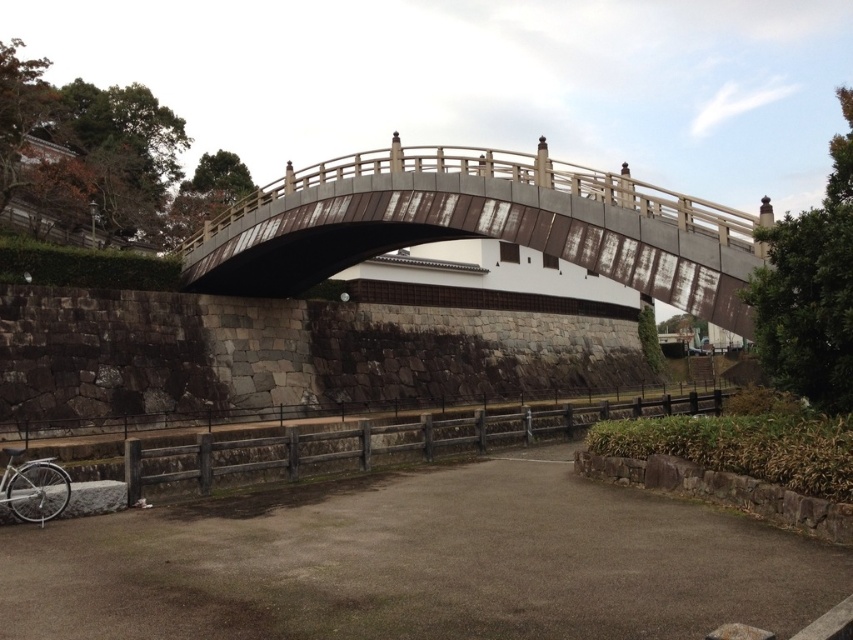
Question: Which point is closer to the camera taking this photo?

Choices:
 (A) (534, 230)
 (B) (32, 490)
 (C) (386, 552)

Answer: (C)

Question: Among these points, which one is nearest to the camera?

Choices:
 (A) (358, 576)
 (B) (445, 237)
 (C) (68, 481)
 (D) (318, 464)

Answer: (A)

Question: Is rusty metal bridge at center above wooden fence at lower center?

Choices:
 (A) no
 (B) yes

Answer: (B)

Question: Which object is positioned farthest from the rusty metal bridge at center?

Choices:
 (A) dull gray asphalt at center
 (B) silver metallic bicycle at lower left

Answer: (B)

Question: Does dull gray asphalt at center appear over rusty metal bridge at center?

Choices:
 (A) no
 (B) yes

Answer: (A)

Question: Does dull gray asphalt at center appear over silver metallic bicycle at lower left?

Choices:
 (A) no
 (B) yes

Answer: (A)